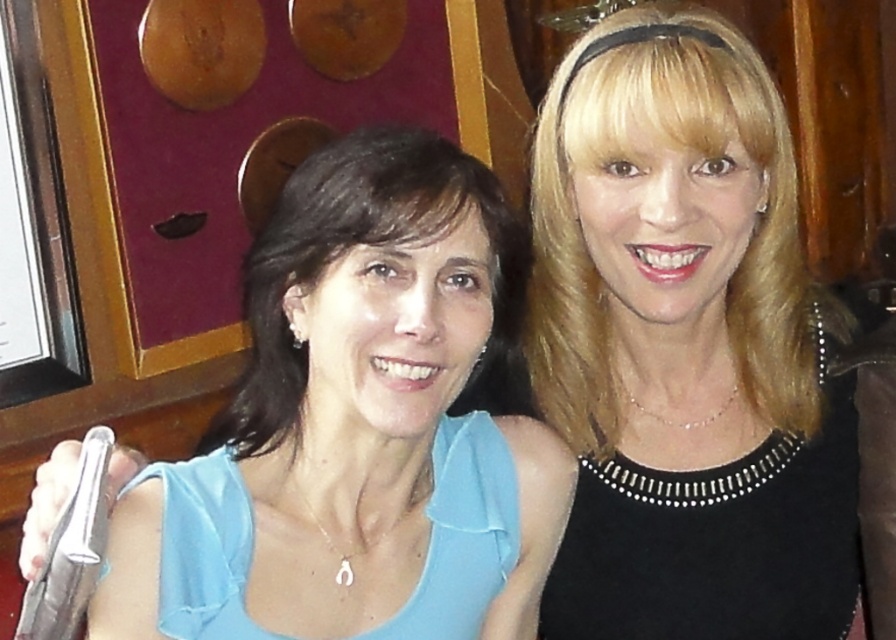
Question: Among these objects, which one is nearest to the camera?

Choices:
 (A) matte blue blouse at center
 (B) black satin dress at upper right

Answer: (A)

Question: Can you confirm if black satin dress at upper right is bigger than matte blue blouse at center?

Choices:
 (A) yes
 (B) no

Answer: (B)

Question: Which of the following is the closest to the observer?

Choices:
 (A) (382, 211)
 (B) (797, 604)

Answer: (A)

Question: Is black satin dress at upper right smaller than matte blue blouse at center?

Choices:
 (A) no
 (B) yes

Answer: (B)

Question: Is the position of black satin dress at upper right less distant than that of matte blue blouse at center?

Choices:
 (A) no
 (B) yes

Answer: (A)